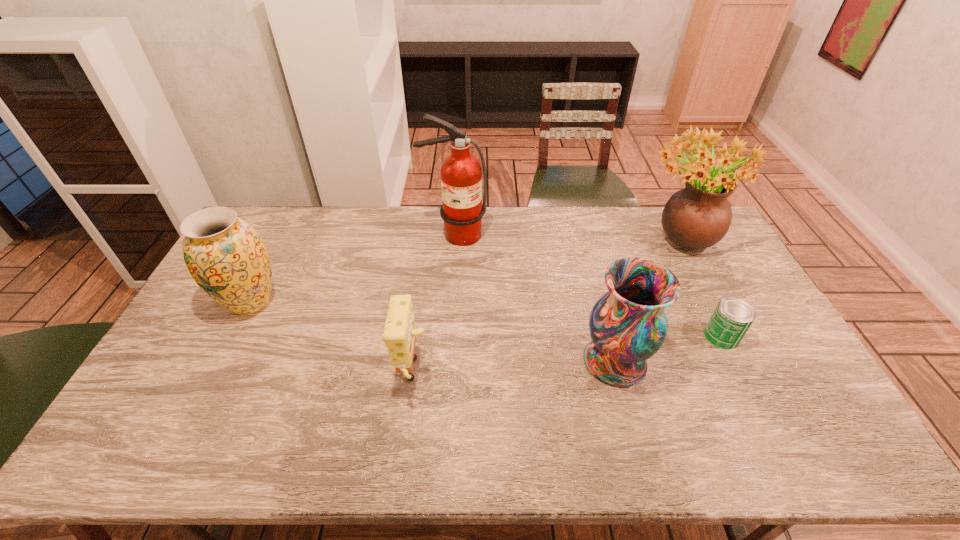
Where is `vacant space that satisfies the following two spatial constraints: 1. on the front side of the third object from right to left; 2. on the face of the sponge`? This screenshot has height=540, width=960. vacant space that satisfies the following two spatial constraints: 1. on the front side of the third object from right to left; 2. on the face of the sponge is located at coordinates (618, 375).

Identify the location of free space in the image that satisfies the following two spatial constraints: 1. on the front side of the left vase; 2. on the right side of the nearer vase. (222, 361).

At what (x,y) coordinates should I click in order to perform the action: click on free region that satisfies the following two spatial constraints: 1. on the nozzle and handle of the fire extinguisher; 2. on the right side of the fifth shortest object. Please return your answer as a coordinate pair (x, y). The image size is (960, 540). Looking at the image, I should click on (454, 240).